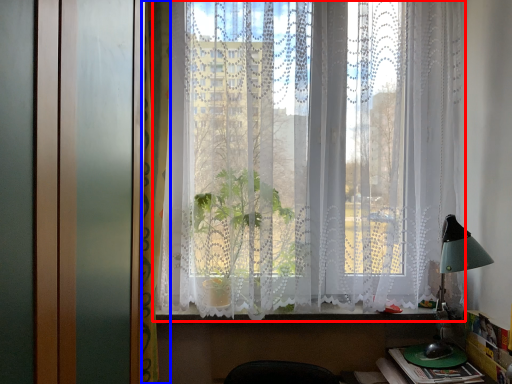
Question: Which object appears closest to the camera in this image, window (highlighted by a red box) or curtain (highlighted by a blue box)?

Choices:
 (A) window
 (B) curtain

Answer: (B)